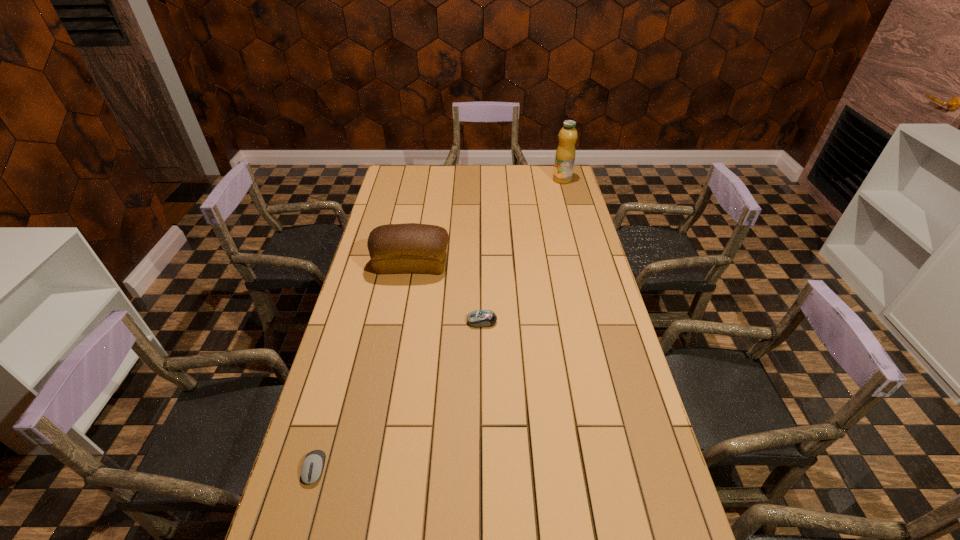
In order to click on the tallest object in this screenshot , I will do 565,154.

The width and height of the screenshot is (960, 540). I want to click on the farthest object, so click(565, 154).

I want to click on bread, so click(x=411, y=247).

Identify the location of the second tallest object. (411, 247).

At what (x,y) coordinates should I click in order to perform the action: click on the second object from right to left. Please return your answer as a coordinate pair (x, y). The width and height of the screenshot is (960, 540). Looking at the image, I should click on (478, 318).

Image resolution: width=960 pixels, height=540 pixels. Identify the location of the third farthest object. [478, 318].

Identify the location of the nearer computer equipment. Image resolution: width=960 pixels, height=540 pixels. (312, 467).

You are a GUI agent. You are given a task and a screenshot of the screen. Output one action in this format:
    pyautogui.click(x=<x>, y=<y>)
    Task: Click on the nearest object
    The height and width of the screenshot is (540, 960).
    Given the screenshot: What is the action you would take?
    pyautogui.click(x=312, y=467)

Locate an element on the screen. The image size is (960, 540). vacant space located on the front label of the fruit juice is located at coordinates (570, 211).

Image resolution: width=960 pixels, height=540 pixels. Identify the location of vacant space located on the right of the third shortest object. (474, 265).